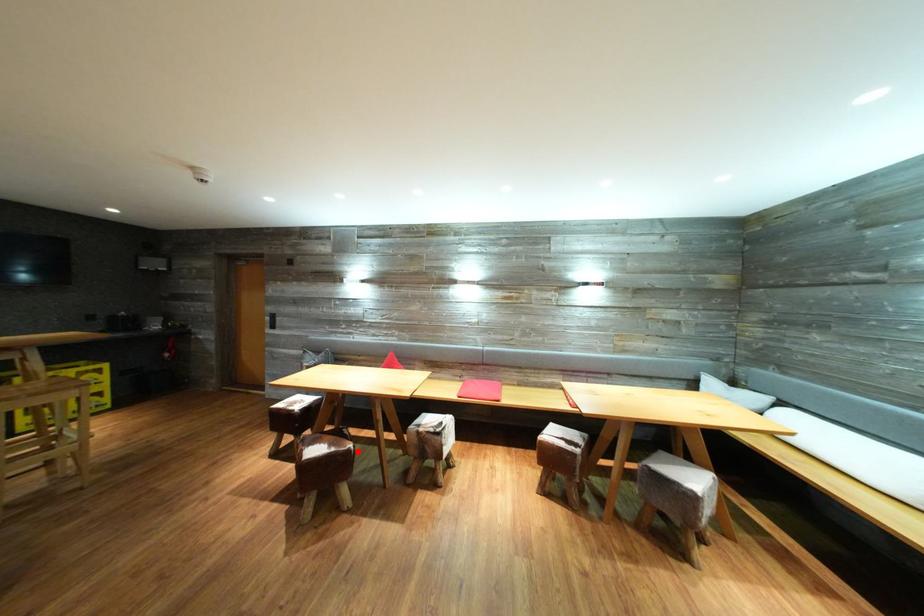
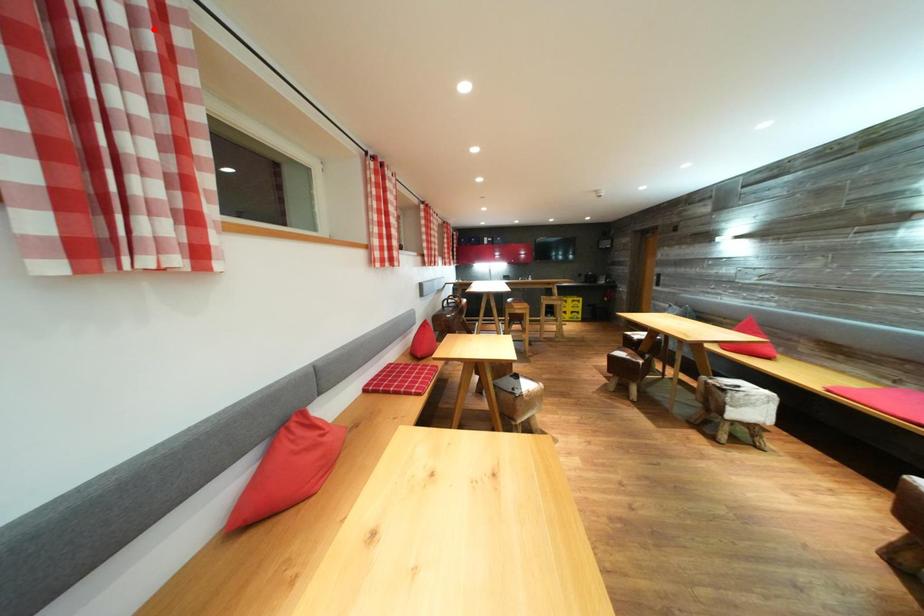
I am providing you with two images of the same scene from different viewpoints. A red point is marked on the first image and another point is marked on the second image. Are the points marked in image1 and image2 representing the same 3D position?

No